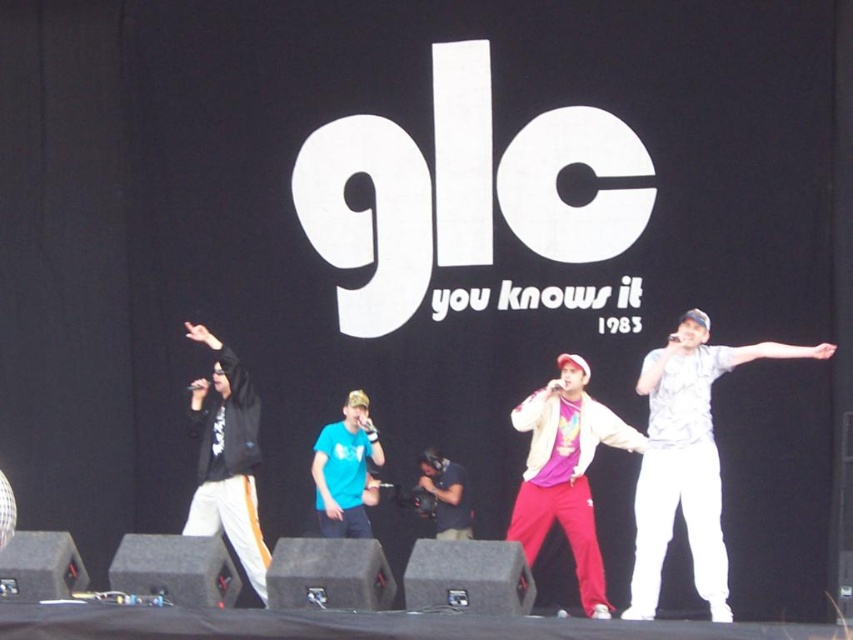
Question: Which point is farther to the camera?

Choices:
 (A) matte black camera at center
 (B) matte pink shirt at center
 (C) matte blue t-shirt at center

Answer: (C)

Question: Does white cotton shirt at right appear on the left side of matte black camera at center?

Choices:
 (A) no
 (B) yes

Answer: (A)

Question: Which object is the farthest from the matte blue t-shirt at center?

Choices:
 (A) black matte jacket at left
 (B) matte black camera at center
 (C) matte pink shirt at center

Answer: (C)

Question: From the image, what is the correct spatial relationship of matte pink shirt at center in relation to matte blue t-shirt at center?

Choices:
 (A) left
 (B) right

Answer: (B)

Question: Can you confirm if matte pink shirt at center is positioned to the right of black matte jacket at left?

Choices:
 (A) yes
 (B) no

Answer: (A)

Question: Which object is positioned farthest from the matte blue t-shirt at center?

Choices:
 (A) white cotton shirt at right
 (B) matte pink shirt at center
 (C) matte black camera at center

Answer: (A)